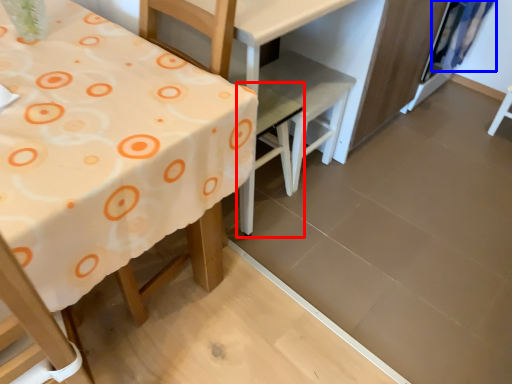
Question: Among these objects, which one is farthest to the camera, chair (highlighted by a red box) or curtain (highlighted by a blue box)?

Choices:
 (A) chair
 (B) curtain

Answer: (B)